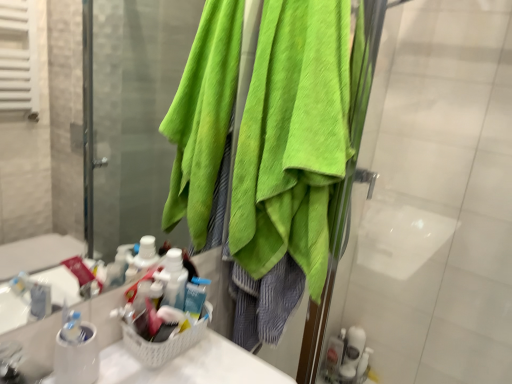
Question: Can you confirm if translucent plastic soap dispenser at lower right, arranged as the 2th toiletry when viewed from the right, is smaller than white glossy toothbrush at lower right, the second toiletry when ordered from left to right?

Choices:
 (A) no
 (B) yes

Answer: (B)

Question: From the image's perspective, is translucent plastic soap dispenser at lower right, the first toiletry viewed from the left, located above white glossy toothbrush at lower right, the second toiletry when ordered from left to right?

Choices:
 (A) no
 (B) yes

Answer: (A)

Question: From a real-world perspective, is translucent plastic soap dispenser at lower right, the first toiletry viewed from the left, located beneath white glossy toothbrush at lower right, which appears as the first toiletry when viewed from the right?

Choices:
 (A) yes
 (B) no

Answer: (A)

Question: Is translucent plastic soap dispenser at lower right, the first toiletry viewed from the left, at the left side of white glossy toothbrush at lower right, which appears as the first toiletry when viewed from the right?

Choices:
 (A) no
 (B) yes

Answer: (B)

Question: Is translucent plastic soap dispenser at lower right, arranged as the 2th toiletry when viewed from the right, oriented away from white glossy toothbrush at lower right, the second toiletry when ordered from left to right?

Choices:
 (A) yes
 (B) no

Answer: (B)

Question: From a real-world perspective, is white glossy toothbrush at lower right, which appears as the first toiletry when viewed from the right, physically located above or below translucent plastic soap dispenser at lower right, arranged as the 2th toiletry when viewed from the right?

Choices:
 (A) above
 (B) below

Answer: (A)

Question: In the image, is white glossy toothbrush at lower right, the second toiletry when ordered from left to right, on the left side or the right side of translucent plastic soap dispenser at lower right, the first toiletry viewed from the left?

Choices:
 (A) right
 (B) left

Answer: (A)

Question: Considering the positions of white glossy toothbrush at lower right, which appears as the first toiletry when viewed from the right, and translucent plastic soap dispenser at lower right, the first toiletry viewed from the left, in the image, is white glossy toothbrush at lower right, which appears as the first toiletry when viewed from the right, bigger or smaller than translucent plastic soap dispenser at lower right, the first toiletry viewed from the left,?

Choices:
 (A) small
 (B) big

Answer: (B)

Question: Is white glossy toothbrush at lower right, the second toiletry when ordered from left to right, inside or outside of translucent plastic soap dispenser at lower right, the first toiletry viewed from the left?

Choices:
 (A) inside
 (B) outside

Answer: (B)

Question: Based on their positions, is white glossy toothbrush at lower right, the second toiletry when ordered from left to right, located to the left or right of green towel at upper right?

Choices:
 (A) left
 (B) right

Answer: (A)

Question: Would you say white glossy toothbrush at lower right, the second toiletry when ordered from left to right, is inside or outside green towel at upper right?

Choices:
 (A) outside
 (B) inside

Answer: (A)

Question: Is white glossy toothbrush at lower right, which appears as the first toiletry when viewed from the right, in front of or behind green towel at upper right in the image?

Choices:
 (A) behind
 (B) front

Answer: (A)

Question: Considering the positions of white glossy toothbrush at lower right, the second toiletry when ordered from left to right, and green towel at upper right in the image, is white glossy toothbrush at lower right, the second toiletry when ordered from left to right, taller or shorter than green towel at upper right?

Choices:
 (A) tall
 (B) short

Answer: (B)

Question: Choose the correct answer: Is translucent plastic soap dispenser at lower right, the first toiletry viewed from the left, inside white glossy toothbrush at lower right, which appears as the first toiletry when viewed from the right, or outside it?

Choices:
 (A) outside
 (B) inside

Answer: (A)

Question: From a real-world perspective, is translucent plastic soap dispenser at lower right, the first toiletry viewed from the left, physically located above or below white glossy toothbrush at lower right, the second toiletry when ordered from left to right?

Choices:
 (A) above
 (B) below

Answer: (B)